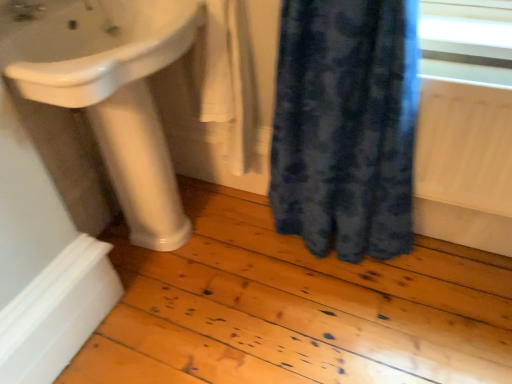
This screenshot has width=512, height=384. What do you see at coordinates (98, 48) in the screenshot? I see `white glossy sink at upper left` at bounding box center [98, 48].

Measure the distance between white cotton towel at center and camera.

white cotton towel at center and camera are 3.72 feet apart from each other.

Identify the location of matte white tap at upper left. (26, 9).

Consider the image. Is white glossy pedestal at lower left not near white cotton towel at center?

white glossy pedestal at lower left is actually quite close to white cotton towel at center.

You are a GUI agent. You are given a task and a screenshot of the screen. Output one action in this format:
    pyautogui.click(x=<x>, y=<y>)
    Task: Click on the pillar below the white cotton towel at center (from the image's perspective)
    
    Given the screenshot: What is the action you would take?
    pyautogui.click(x=140, y=167)

In terms of height, does white glossy pedestal at lower left look taller or shorter compared to white cotton towel at center?

white glossy pedestal at lower left is taller than white cotton towel at center.

Can you confirm if white glossy pedestal at lower left is smaller than white cotton towel at center?

Actually, white glossy pedestal at lower left might be larger than white cotton towel at center.

Would you say white glossy pedestal at lower left is to the left or to the right of matte white tap at upper left in the picture?

white glossy pedestal at lower left is to the right of matte white tap at upper left.

Which of these two, white glossy pedestal at lower left or matte white tap at upper left, is bigger?

Bigger between the two is white glossy pedestal at lower left.

Which is behind, white glossy pedestal at lower left or matte white tap at upper left?

white glossy pedestal at lower left is further from the camera.

Which is further, (168, 232) or (14, 16)?

Point (168, 232)

Which of these two, matte white tap at upper left or white glossy sink at upper left, is thinner?

Thinner between the two is matte white tap at upper left.

Is point (38, 7) closer to camera compared to point (124, 58)?

That is False.

From a real-world perspective, does matte white tap at upper left stand above white glossy sink at upper left?

Indeed, from a real-world perspective, matte white tap at upper left stands above white glossy sink at upper left.

Where is `sink located in front of the matte white tap at upper left`? The image size is (512, 384). sink located in front of the matte white tap at upper left is located at coordinates (98, 48).

Considering the sizes of objects white glossy sink at upper left and white glossy pedestal at lower left in the image provided, who is smaller, white glossy sink at upper left or white glossy pedestal at lower left?

white glossy pedestal at lower left is smaller.

Which object is wider, white glossy sink at upper left or white glossy pedestal at lower left?

white glossy sink at upper left.

Which is farther from the camera, (53, 88) or (172, 238)?

The point (172, 238) is farther.

Is white glossy sink at upper left facing towards white glossy pedestal at lower left?

No, white glossy sink at upper left does not turn towards white glossy pedestal at lower left.

Considering the sizes of objects matte white tap at upper left and white glossy pedestal at lower left in the image provided, who is bigger, matte white tap at upper left or white glossy pedestal at lower left?

With larger size is white glossy pedestal at lower left.

Is matte white tap at upper left next to white glossy pedestal at lower left and touching it?

There is a gap between matte white tap at upper left and white glossy pedestal at lower left.

Which of these two, matte white tap at upper left or white glossy pedestal at lower left, stands shorter?

matte white tap at upper left is shorter.

From a real-world perspective, is matte white tap at upper left below white glossy pedestal at lower left?

No, from a real-world perspective, matte white tap at upper left is not below white glossy pedestal at lower left.

Is blue textured fabric at lower right directly adjacent to white glossy pedestal at lower left?

blue textured fabric at lower right and white glossy pedestal at lower left are clearly separated.

Looking at their sizes, would you say blue textured fabric at lower right is wider or thinner than white glossy pedestal at lower left?

Clearly, blue textured fabric at lower right has more width compared to white glossy pedestal at lower left.

What's the angular difference between blue textured fabric at lower right and white glossy pedestal at lower left's facing directions?

There is a 88.6-degree angle between the facing directions of blue textured fabric at lower right and white glossy pedestal at lower left.

Is white cotton towel at center closer to the viewer compared to white glossy pedestal at lower left?

No, the depth of white cotton towel at center is greater than that of white glossy pedestal at lower left.

Is white cotton towel at center spatially inside white glossy pedestal at lower left, or outside of it?

The correct answer is: outside.

Which object is positioned more to the right, white cotton towel at center or white glossy pedestal at lower left?

white cotton towel at center is more to the right.

You are a GUI agent. You are given a task and a screenshot of the screen. Output one action in this format:
    pyautogui.click(x=<x>, y=<y>)
    Task: Click on the bath towel located above the white glossy pedestal at lower left (from the image's perspective)
    
    Given the screenshot: What is the action you would take?
    pyautogui.click(x=229, y=77)

This screenshot has width=512, height=384. I want to click on pillar that is under the matte white tap at upper left (from a real-world perspective), so click(140, 167).

Estimate the real-world distances between objects in this image. Which object is closer to white glossy sink at upper left, white cotton towel at center or blue textured fabric at lower right?

Based on the image, white cotton towel at center appears to be nearer to white glossy sink at upper left.

Looking at the image, which one is located closer to white glossy pedestal at lower left, blue textured fabric at lower right or white cotton towel at center?

white cotton towel at center is positioned closer to the anchor white glossy pedestal at lower left.

Which object lies further to the anchor point white glossy sink at upper left, white cotton towel at center or white glossy pedestal at lower left?

white cotton towel at center lies further to white glossy sink at upper left than the other object.

Looking at the image, which one is located closer to white glossy sink at upper left, blue textured fabric at lower right or matte white tap at upper left?

matte white tap at upper left is closer to white glossy sink at upper left.

Based on their spatial positions, is white glossy pedestal at lower left or white cotton towel at center further from white glossy sink at upper left?

Among the two, white cotton towel at center is located further to white glossy sink at upper left.

Looking at this image, looking at the image, which one is located further to blue textured fabric at lower right, white cotton towel at center or white glossy sink at upper left?

white glossy sink at upper left.

Which object lies nearer to the anchor point blue textured fabric at lower right, matte white tap at upper left or white cotton towel at center?

Based on the image, white cotton towel at center appears to be nearer to blue textured fabric at lower right.

Considering their positions, is matte white tap at upper left positioned closer to white glossy sink at upper left than white cotton towel at center?

Based on the image, matte white tap at upper left appears to be nearer to white glossy sink at upper left.

Locate an element on the screen. This screenshot has height=384, width=512. sink between matte white tap at upper left and white cotton towel at center in the horizontal direction is located at coordinates (98, 48).

Where is `sink between matte white tap at upper left and white glossy pedestal at lower left in the up-down direction`? sink between matte white tap at upper left and white glossy pedestal at lower left in the up-down direction is located at coordinates (98, 48).

The height and width of the screenshot is (384, 512). I want to click on bath towel between white glossy sink at upper left and blue textured fabric at lower right, so click(229, 77).

Where is `pillar between white glossy sink at upper left and white cotton towel at center along the z-axis`? The width and height of the screenshot is (512, 384). pillar between white glossy sink at upper left and white cotton towel at center along the z-axis is located at coordinates (140, 167).